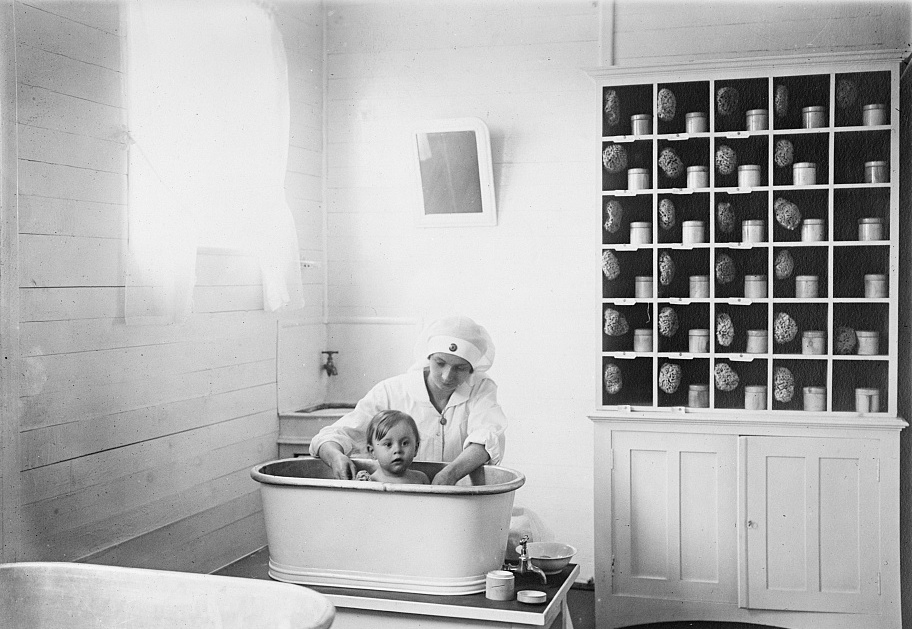
Locate an element on the screen. This screenshot has width=912, height=629. cabinet door is located at coordinates (814, 514), (671, 526).